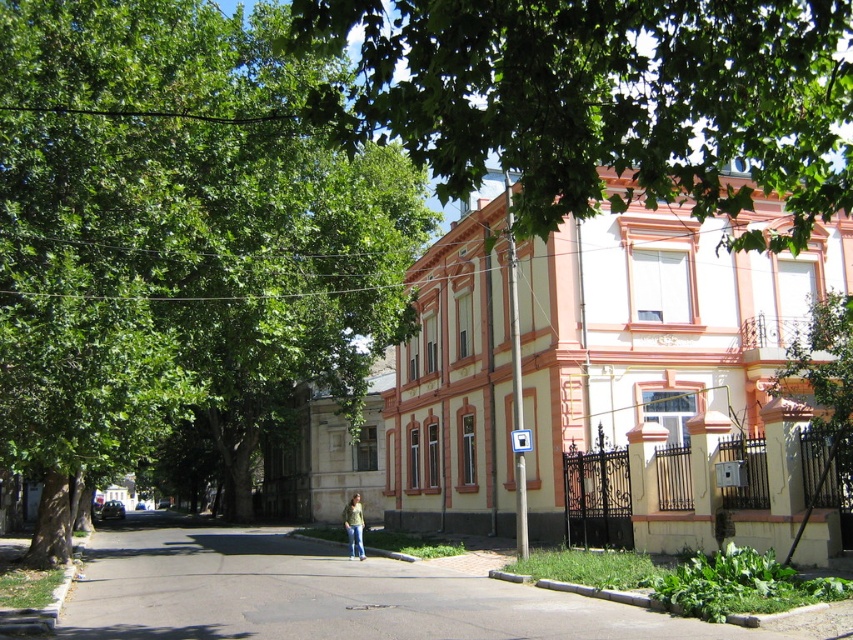
You are a pedestrian standing on the sidewalk and see the green leafy tree at upper center and the jeans at center. Which object is higher in the scene?

The green leafy tree at upper center is higher than the jeans at center.

Consider the image. You are standing on the paved road and want to take a photo of the two green leafy trees. Which tree, the green leafy tree at center or the green leafy tree at upper center, will appear closer to you in the photo?

The green leafy tree at center will appear closer to you in the photo because it is in front of the green leafy tree at upper center, which is positioned behind it.

You are a pedestrian standing on the paved road in the urban street scene. You notice a green leafy tree at center and jeans at center. Which object is higher up in the scene?

The green leafy tree at center is located above jeans at center, so it is higher up in the scene.